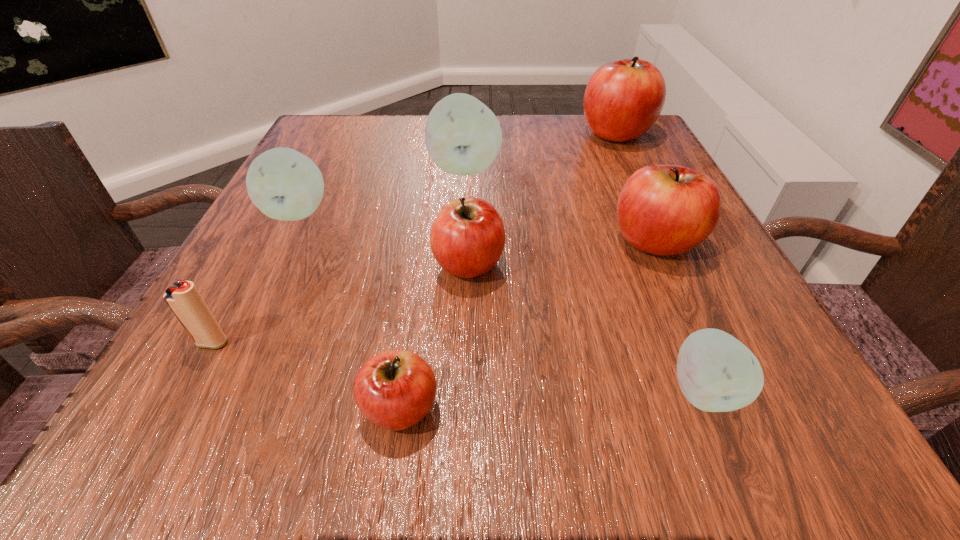
Locate an element on the screen. apple that is the sixth nearest to the biggest red apple is located at coordinates (394, 390).

Select which red apple appears as the closest to the leftmost apple. Please provide its 2D coordinates. Your answer should be formatted as a tuple, i.e. [(x, y)], where the tuple contains the x and y coordinates of a point satisfying the conditions above.

[(467, 239)]

At what (x,y) coordinates should I click in order to perform the action: click on red apple that is the third closest one to the second farthest white apple. Please return your answer as a coordinate pair (x, y). The image size is (960, 540). Looking at the image, I should click on (663, 209).

In order to click on white apple that stands as the closest to the second biggest red apple in this screenshot , I will do `click(716, 372)`.

Identify which white apple is the nearest to the second smallest red apple. Please provide its 2D coordinates. Your answer should be formatted as a tuple, i.e. [(x, y)], where the tuple contains the x and y coordinates of a point satisfying the conditions above.

[(463, 136)]

Locate an element on the screen. The height and width of the screenshot is (540, 960). blank space that satisfies the following two spatial constraints: 1. on the back side of the third smallest red apple; 2. on the right side of the smallest red apple is located at coordinates (424, 241).

At what (x,y) coordinates should I click in order to perform the action: click on free space that satisfies the following two spatial constraints: 1. on the back side of the second smallest red apple; 2. on the right side of the red igniter. Please return your answer as a coordinate pair (x, y). The image size is (960, 540). Looking at the image, I should click on (255, 264).